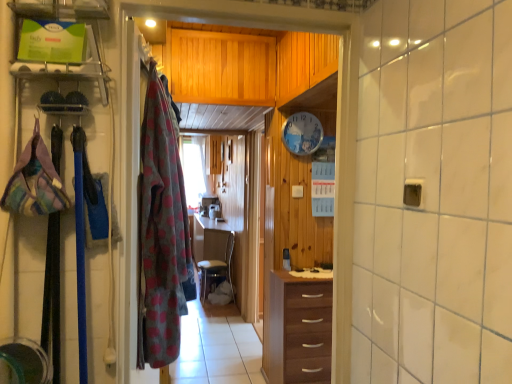
Question: From a real-world perspective, is clear plastic shelf at upper left physically located above or below brown wood chest of drawers at center?

Choices:
 (A) above
 (B) below

Answer: (A)

Question: Is clear plastic shelf at upper left bigger or smaller than brown wood chest of drawers at center?

Choices:
 (A) big
 (B) small

Answer: (B)

Question: Estimate the real-world distances between objects in this image. Which object is farther from the brown wood chest of drawers at center?

Choices:
 (A) fluffy polka dot blanket at left, which ranks as the 2th clothing in front-to-back order
 (B) plaid fabric bag at left, the 1th clothing from the left
 (C) clear plastic shelf at upper left
 (D) wooden drawer at center
 (E) wooden clock at center

Answer: (C)

Question: Which object is the closest to the brown wood chest of drawers at center?

Choices:
 (A) wooden drawer at center
 (B) clear plastic shelf at upper left
 (C) plaid fabric bag at left, positioned as the 2th clothing in back-to-front order
 (D) wooden clock at center
 (E) fluffy polka dot blanket at left, which ranks as the 2th clothing in front-to-back order

Answer: (A)